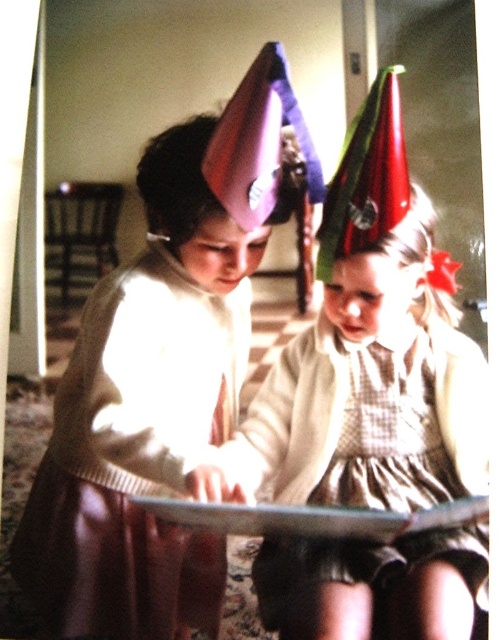
Question: Is matte white sweater at center bigger than checkered fabric dress at center?

Choices:
 (A) yes
 (B) no

Answer: (A)

Question: Does matte white sweater at center appear under checkered fabric dress at center?

Choices:
 (A) yes
 (B) no

Answer: (B)

Question: Which point appears closest to the camera in this image?

Choices:
 (A) (83, 356)
 (B) (351, 451)

Answer: (A)

Question: Which point is closer to the camera?

Choices:
 (A) checkered fabric dress at center
 (B) matte white sweater at center

Answer: (A)

Question: Is matte white sweater at center above checkered fabric dress at center?

Choices:
 (A) yes
 (B) no

Answer: (A)